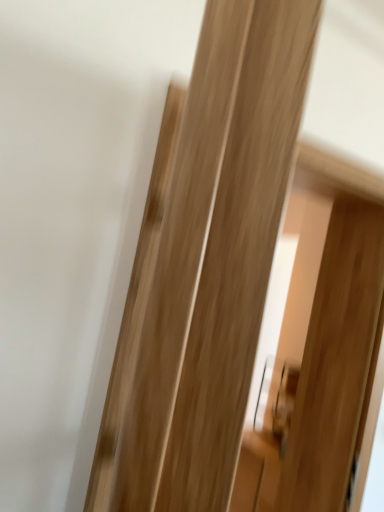
Image resolution: width=384 pixels, height=512 pixels. I want to click on natural wood screen door at center, so click(329, 356).

What do you see at coordinates (329, 356) in the screenshot?
I see `natural wood screen door at center` at bounding box center [329, 356].

Measure the distance between natural wood door at center and camera.

natural wood door at center is 5.33 inches from camera.

The height and width of the screenshot is (512, 384). What do you see at coordinates (205, 263) in the screenshot?
I see `natural wood door at center` at bounding box center [205, 263].

This screenshot has width=384, height=512. I want to click on natural wood door at center, so click(x=205, y=263).

In order to face natural wood door at center, should I rotate leftwards or rightwards?

Rotate left and turn 3.776 degrees.

Where is `natural wood screen door at center`? natural wood screen door at center is located at coordinates (329, 356).

Is natural wood door at center to the right of natural wood screen door at center from the viewer's perspective?

No, natural wood door at center is not to the right of natural wood screen door at center.

Which object is closer to the camera, natural wood door at center or natural wood screen door at center?

natural wood door at center is in front.

Which point is more distant from viewer, (x=183, y=97) or (x=356, y=396)?

Positioned behind is point (x=356, y=396).

From the image's perspective, which is above, natural wood door at center or natural wood screen door at center?

natural wood door at center appears higher in the image.

From a real-world perspective, is natural wood door at center above or below natural wood screen door at center?

Clearly, from a real-world perspective, natural wood door at center is above natural wood screen door at center.

Is natural wood door at center thinner than natural wood screen door at center?

Yes.

From their relative heights in the image, would you say natural wood door at center is taller or shorter than natural wood screen door at center?

In the image, natural wood door at center appears to be shorter than natural wood screen door at center.

Considering the relative sizes of natural wood door at center and natural wood screen door at center in the image provided, is natural wood door at center smaller than natural wood screen door at center?

Yes.

Is natural wood door at center spatially inside natural wood screen door at center, or outside of it?

The correct answer is: outside.

Is the surface of natural wood door at center in direct contact with natural wood screen door at center?

natural wood door at center and natural wood screen door at center are not in contact.

Is natural wood door at center facing away from natural wood screen door at center?

natural wood door at center does not have its back to natural wood screen door at center.

How many degrees apart are the facing directions of natural wood door at center and natural wood screen door at center?

natural wood door at center and natural wood screen door at center are facing 66.6 degrees away from each other.

Looking at this image, how much distance is there between natural wood door at center and natural wood screen door at center?

A distance of 4.03 feet exists between natural wood door at center and natural wood screen door at center.

The image size is (384, 512). I want to click on door that is on the left side of natural wood screen door at center, so click(205, 263).

Which object is positioned more to the left, natural wood screen door at center or natural wood door at center?

From the viewer's perspective, natural wood door at center appears more on the left side.

Which object is further away from the camera taking this photo, natural wood screen door at center or natural wood door at center?

natural wood screen door at center is behind.

Which is closer, (356,450) or (236,311)?

The point (236,311) is in front.

From the image's perspective, is natural wood screen door at center over natural wood door at center?

Incorrect, from the image's perspective, natural wood screen door at center is lower than natural wood door at center.

From a real-world perspective, does natural wood screen door at center sit lower than natural wood door at center?

Yes.

Which object is thinner, natural wood screen door at center or natural wood door at center?

natural wood door at center.

Between natural wood screen door at center and natural wood door at center, which one has less height?

With less height is natural wood door at center.

Considering the relative sizes of natural wood screen door at center and natural wood door at center in the image provided, is natural wood screen door at center bigger than natural wood door at center?

Yes.

Is natural wood screen door at center not within natural wood door at center?

Indeed, natural wood screen door at center is completely outside natural wood door at center.

Are natural wood screen door at center and natural wood door at center making contact?

They are not placed beside each other.

Does natural wood screen door at center turn towards natural wood door at center?

No, natural wood screen door at center is not aimed at natural wood door at center.

Measure the distance between natural wood screen door at center and natural wood door at center.

natural wood screen door at center and natural wood door at center are 4.03 feet apart from each other.

Image resolution: width=384 pixels, height=512 pixels. I want to click on screen door below the natural wood door at center (from the image's perspective), so click(x=329, y=356).

At what (x,y) coordinates should I click in order to perform the action: click on screen door behind the natural wood door at center. Please return your answer as a coordinate pair (x, y). This screenshot has height=512, width=384. Looking at the image, I should click on (329, 356).

The height and width of the screenshot is (512, 384). Find the location of `screen door below the natural wood door at center (from the image's perspective)`. screen door below the natural wood door at center (from the image's perspective) is located at coordinates (329, 356).